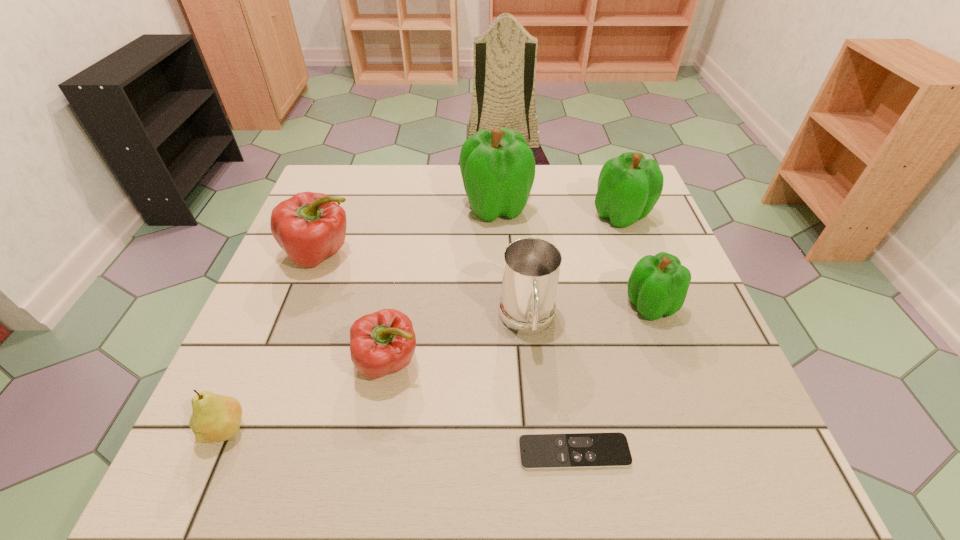
This screenshot has height=540, width=960. I want to click on free region located 0.050m on the left of the remote control, so click(489, 452).

Image resolution: width=960 pixels, height=540 pixels. In order to click on pear positioned at the near edge in this screenshot , I will do `click(215, 417)`.

Find the location of a particular element. The height and width of the screenshot is (540, 960). remote control that is at the near edge is located at coordinates (578, 450).

The width and height of the screenshot is (960, 540). Identify the location of bell pepper situated at the left edge. (310, 227).

At what (x,y) coordinates should I click in order to perform the action: click on pear that is positioned at the left edge. Please return your answer as a coordinate pair (x, y). Looking at the image, I should click on (215, 417).

At what (x,y) coordinates should I click in order to perform the action: click on object positioned at the near left corner. Please return your answer as a coordinate pair (x, y). Looking at the image, I should click on (215, 417).

Where is `object present at the far right corner`? The image size is (960, 540). object present at the far right corner is located at coordinates (629, 186).

Find the location of a particular element. This screenshot has width=960, height=540. free space at the far edge is located at coordinates (410, 179).

I want to click on free location at the near edge, so click(x=664, y=442).

In the image, there is a desktop. Where is `vacant region at the left edge`? vacant region at the left edge is located at coordinates (265, 406).